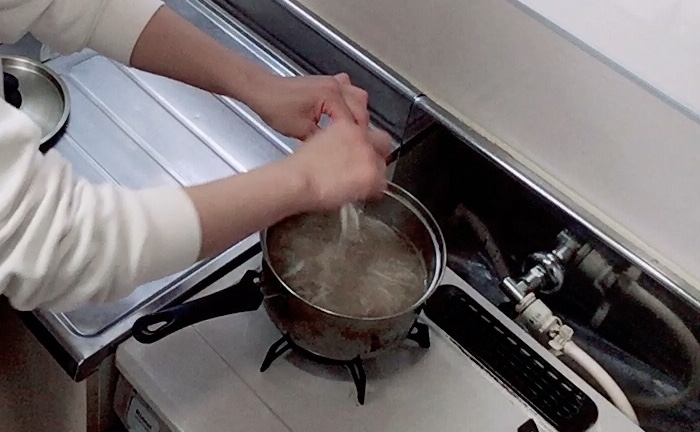
Where is `metal countertop`? The image size is (700, 432). metal countertop is located at coordinates (167, 140).